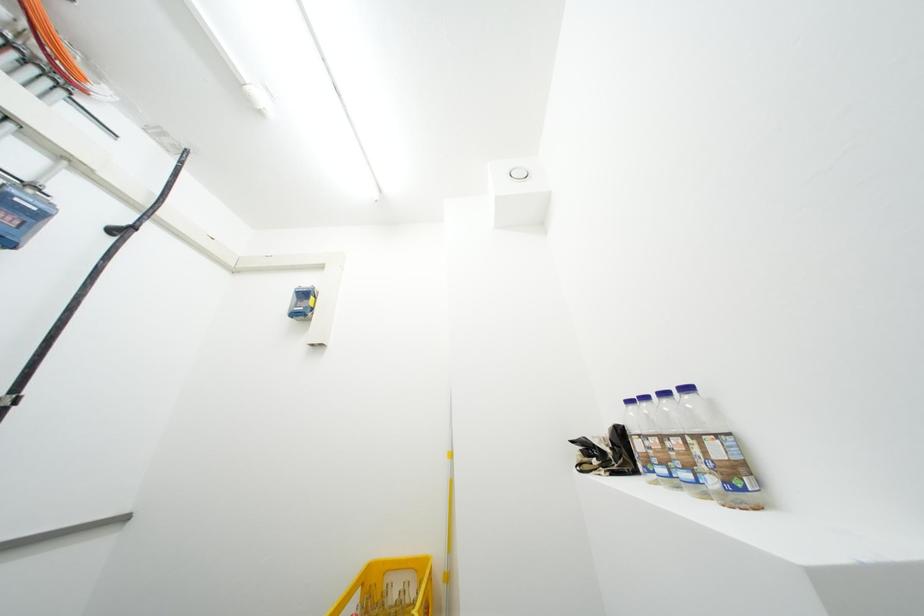
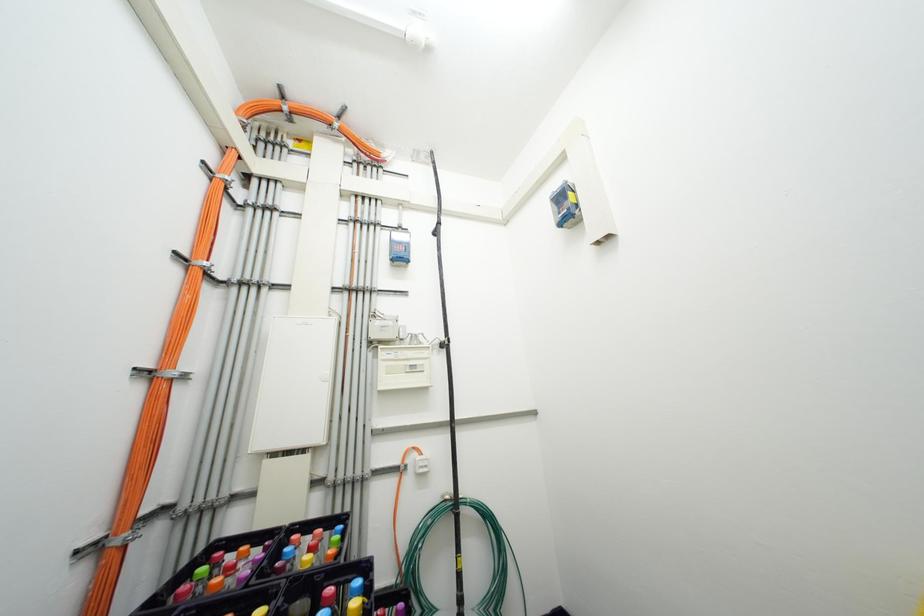
Question: The camera is either moving clockwise (left) or counter-clockwise (right) around the object. The first image is from the beginning of the video and the second image is from the end. Is the camera moving left or right when shooting the video?

Choices:
 (A) Left
 (B) Right

Answer: (B)